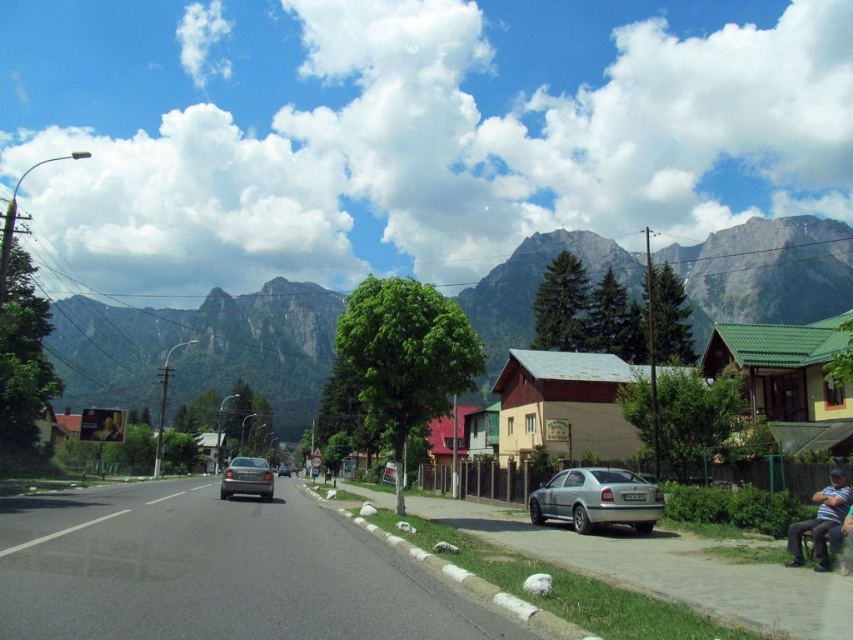
Question: Among these points, which one is nearest to the camera?

Choices:
 (A) (277, 472)
 (B) (239, 486)
 (C) (560, 492)

Answer: (C)

Question: Is silver metallic sedan at center-right to the right of satin silver sedan at center from the viewer's perspective?

Choices:
 (A) no
 (B) yes

Answer: (B)

Question: Which point is closer to the camera?

Choices:
 (A) silver metallic sedan at center-right
 (B) silver metallic sedan at center

Answer: (A)

Question: Is the position of dark blue denim pants at lower right less distant than that of satin silver sedan at center?

Choices:
 (A) yes
 (B) no

Answer: (A)

Question: Can you confirm if green rocky mountain at upper center is positioned below silver metallic sedan at center?

Choices:
 (A) yes
 (B) no

Answer: (B)

Question: Among these objects, which one is farthest from the camera?

Choices:
 (A) green rocky mountain at upper center
 (B) silver metallic sedan at center

Answer: (A)